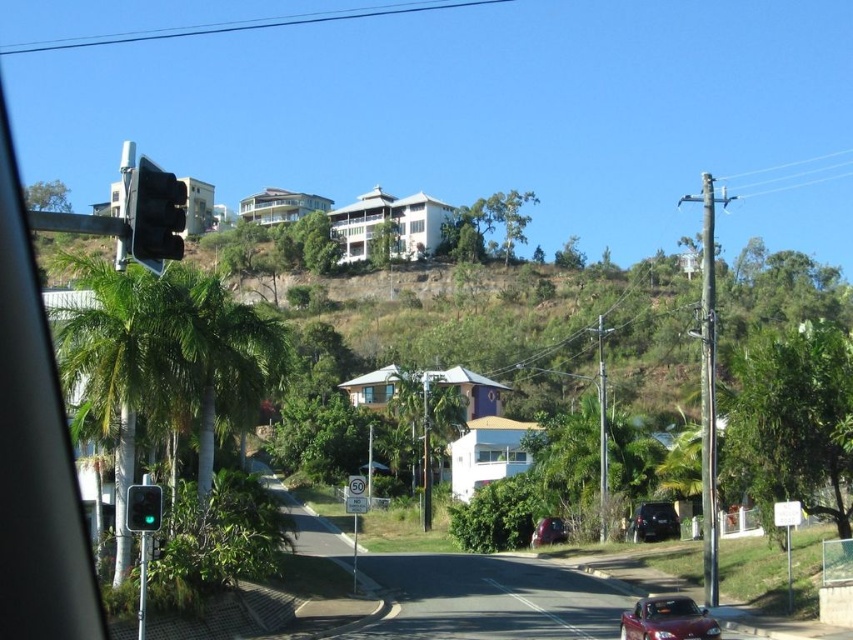
You are standing at the intersection and want to take a photo of the two points mentioned. Which point, point [704,634] or point [154,516], will appear larger in your camera view?

Point [704,634] is further to the camera than point [154,516], so it will appear larger in the camera view.

You are a driver approaching the intersection. You see the green glass traffic light at left and the metallic red car at center. Which object takes up more visual space in your view?

The metallic red car at center takes up more visual space than the green glass traffic light at left.